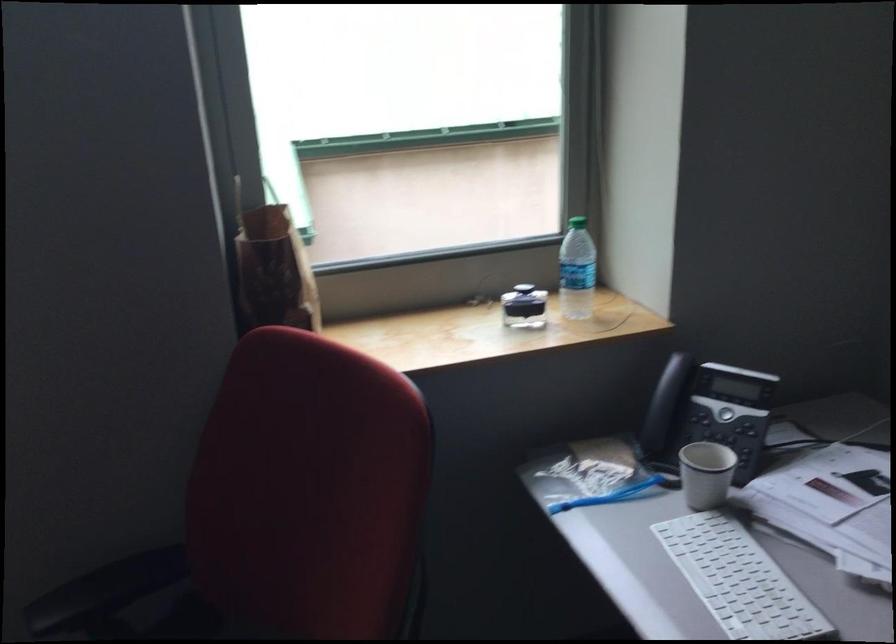
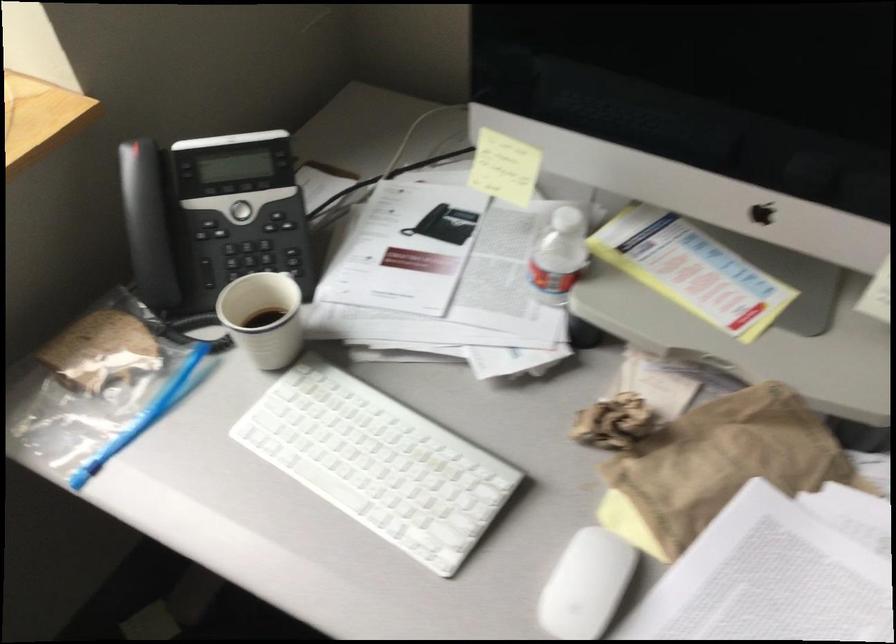
In the second image, find the point that corresponds to (713,480) in the first image.

(263, 317)